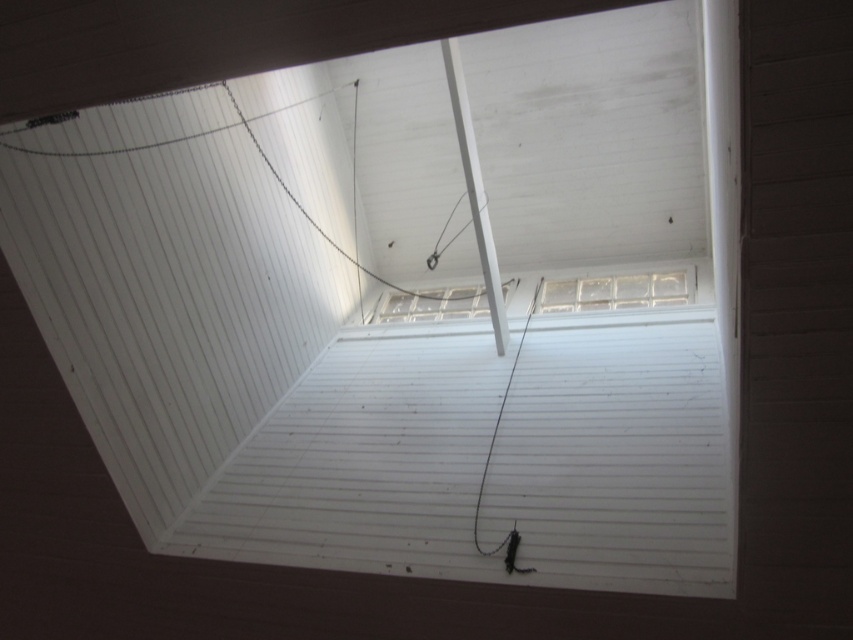
You are standing in a room with a skylight and looking up at the ceiling. You notice two points marked in the scene. Which point is closer to you, point at coordinate (x=611, y=307) or point at coordinate (x=402, y=320)?

Point at coordinate (x=611, y=307) is closer to you than point at coordinate (x=402, y=320).

You are looking up at the ceiling structure and notice two elements at the upper center. Which one is closer to you, the white glossy beam at upper center or the clear glass window at upper center?

The white glossy beam at upper center is closer to the viewer than the clear glass window at upper center.

You are an interior designer evaluating the lighting in this space. You notice the white glossy beam at upper center and the clear glass window at upper center. Which object is positioned to the left of the other?

The white glossy beam at upper center is to the left of the clear glass window at upper center.